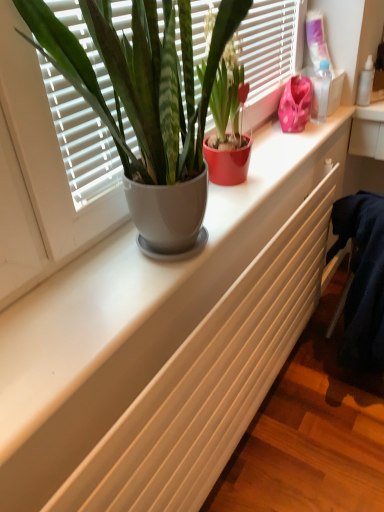
Question: Are transparent plastic bottle at upper right, acting as the 2th toiletry starting from the back, and pink fabric at upper right making contact?

Choices:
 (A) no
 (B) yes

Answer: (B)

Question: Can you confirm if transparent plastic bottle at upper right, the first toiletry in the left-to-right sequence, is wider than pink fabric at upper right?

Choices:
 (A) no
 (B) yes

Answer: (A)

Question: Is transparent plastic bottle at upper right, which is the 1th toiletry from front to back, at the left side of pink fabric at upper right?

Choices:
 (A) no
 (B) yes

Answer: (B)

Question: Can you confirm if transparent plastic bottle at upper right, which is the 1th toiletry from front to back, is smaller than pink fabric at upper right?

Choices:
 (A) no
 (B) yes

Answer: (B)

Question: From the image's perspective, is transparent plastic bottle at upper right, acting as the 2th toiletry starting from the back, above pink fabric at upper right?

Choices:
 (A) yes
 (B) no

Answer: (B)

Question: Would you say transparent plastic bottle at upper right, the first toiletry in the left-to-right sequence, is to the left or to the right of matte ceramic pot at center, the second houseplant when ordered from left to right, in the picture?

Choices:
 (A) right
 (B) left

Answer: (A)

Question: Do you think transparent plastic bottle at upper right, acting as the 2th toiletry starting from the back, is within matte ceramic pot at center, arranged as the 1th houseplant when viewed from the right, or outside of it?

Choices:
 (A) outside
 (B) inside

Answer: (A)

Question: Considering the positions of transparent plastic bottle at upper right, the first toiletry in the left-to-right sequence, and matte ceramic pot at center, arranged as the 1th houseplant when viewed from the right, in the image, is transparent plastic bottle at upper right, the first toiletry in the left-to-right sequence, taller or shorter than matte ceramic pot at center, arranged as the 1th houseplant when viewed from the right,?

Choices:
 (A) tall
 (B) short

Answer: (B)

Question: Considering the positions of transparent plastic bottle at upper right, the 2th toiletry when ordered from right to left, and matte ceramic pot at center, the second houseplant when ordered from left to right, in the image, is transparent plastic bottle at upper right, the 2th toiletry when ordered from right to left, wider or thinner than matte ceramic pot at center, the second houseplant when ordered from left to right,?

Choices:
 (A) thin
 (B) wide

Answer: (A)

Question: Considering the positions of pink fabric at upper right and matte ceramic pot at center, the second houseplant when ordered from left to right, in the image, is pink fabric at upper right wider or thinner than matte ceramic pot at center, the second houseplant when ordered from left to right,?

Choices:
 (A) thin
 (B) wide

Answer: (A)

Question: Does point (314, 72) appear closer or farther from the camera than point (210, 22)?

Choices:
 (A) closer
 (B) farther

Answer: (B)

Question: From the image's perspective, is pink fabric at upper right located above or below matte ceramic pot at center, the second houseplant when ordered from left to right?

Choices:
 (A) below
 (B) above

Answer: (B)

Question: From a real-world perspective, is pink fabric at upper right above or below matte ceramic pot at center, the second houseplant when ordered from left to right?

Choices:
 (A) below
 (B) above

Answer: (A)

Question: Would you say transparent plastic bottle at upper right, acting as the 2th toiletry starting from the back, is to the left or to the right of white matte radiator at center in the picture?

Choices:
 (A) right
 (B) left

Answer: (A)

Question: Is transparent plastic bottle at upper right, the first toiletry in the left-to-right sequence, inside the boundaries of white matte radiator at center, or outside?

Choices:
 (A) outside
 (B) inside

Answer: (A)